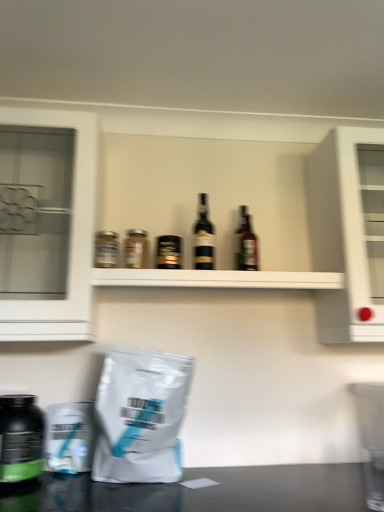
Question: From the image's perspective, is white matte grocery bag at lower left on top of white glass cabinet at left, which is counted as the 2th cabinetry, starting from the right?

Choices:
 (A) yes
 (B) no

Answer: (B)

Question: Considering the relative sizes of white matte grocery bag at lower left and white glass cabinet at left, which appears as the first cabinetry when viewed from the left, in the image provided, is white matte grocery bag at lower left smaller than white glass cabinet at left, which appears as the first cabinetry when viewed from the left,?

Choices:
 (A) no
 (B) yes

Answer: (B)

Question: Considering the relative sizes of white matte grocery bag at lower left and white glass cabinet at left, which appears as the first cabinetry when viewed from the left, in the image provided, is white matte grocery bag at lower left thinner than white glass cabinet at left, which appears as the first cabinetry when viewed from the left,?

Choices:
 (A) yes
 (B) no

Answer: (A)

Question: Can you confirm if white matte grocery bag at lower left is positioned to the right of white glass cabinet at left, which is counted as the 2th cabinetry, starting from the right?

Choices:
 (A) no
 (B) yes

Answer: (B)

Question: Does white matte grocery bag at lower left turn towards white glass cabinet at left, which appears as the first cabinetry when viewed from the left?

Choices:
 (A) yes
 (B) no

Answer: (B)

Question: Is white glass cabinet at left, which appears as the first cabinetry when viewed from the left, wider or thinner than black glass bottle at center, the 2th bottle when ordered from right to left?

Choices:
 (A) thin
 (B) wide

Answer: (B)

Question: Considering the positions of point (8, 322) and point (203, 239), is point (8, 322) closer or farther from the camera than point (203, 239)?

Choices:
 (A) closer
 (B) farther

Answer: (A)

Question: Would you say white glass cabinet at left, which appears as the first cabinetry when viewed from the left, is to the left or to the right of black glass bottle at center, acting as the 5th bottle starting from the left, in the picture?

Choices:
 (A) right
 (B) left

Answer: (B)

Question: Considering their positions, is white glass cabinet at left, which is counted as the 2th cabinetry, starting from the right, located in front of or behind black glass bottle at center, the 2th bottle when ordered from right to left?

Choices:
 (A) behind
 (B) front

Answer: (B)

Question: From a real-world perspective, relative to metallic silver jar at upper left, positioned as the second bottle in left-to-right order, is white glossy cabinet at upper right, the second cabinetry when ordered from left to right, vertically above or below?

Choices:
 (A) below
 (B) above

Answer: (B)

Question: Is point (332, 233) positioned closer to the camera than point (105, 248)?

Choices:
 (A) closer
 (B) farther

Answer: (B)

Question: Would you say white glossy cabinet at upper right, the second cabinetry when ordered from left to right, is inside or outside metallic silver jar at upper left, positioned as the second bottle in left-to-right order?

Choices:
 (A) inside
 (B) outside

Answer: (B)

Question: From the image's perspective, relative to metallic silver jar at upper left, the fifth bottle when ordered from right to left, is white glossy cabinet at upper right, the second cabinetry when ordered from left to right, above or below?

Choices:
 (A) below
 (B) above

Answer: (B)

Question: From the image's perspective, relative to brown glass bottle at center, which appears as the sixth bottle when viewed from the left, is matte glass jar at center, which is the fourth bottle in right-to-left order, above or below?

Choices:
 (A) above
 (B) below

Answer: (B)

Question: Is matte glass jar at center, which is the 3th bottle from left to right, inside the boundaries of brown glass bottle at center, which appears as the 1th bottle when viewed from the right, or outside?

Choices:
 (A) inside
 (B) outside

Answer: (B)